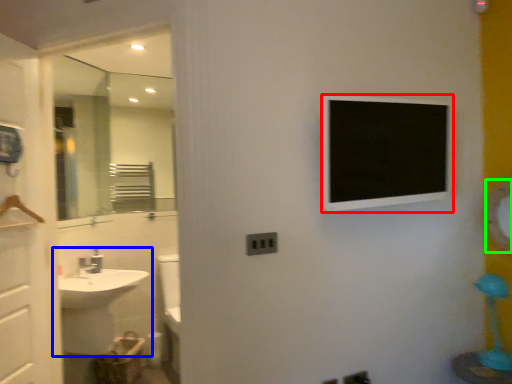
Question: Which object is positioned closest to medicine cabinet (highlighted by a red box)? Select from sink (highlighted by a blue box) and mirror (highlighted by a green box).

Choices:
 (A) sink
 (B) mirror

Answer: (B)